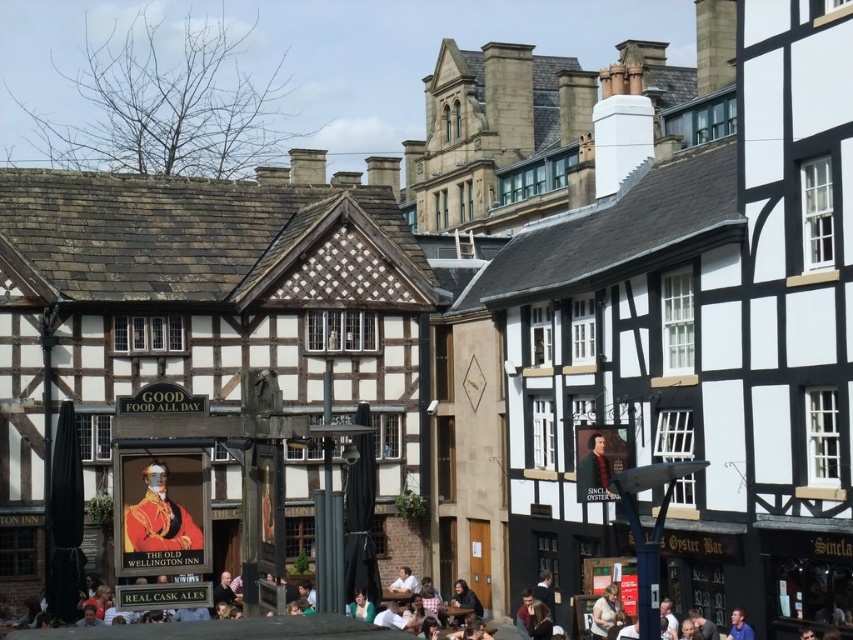
Who is higher up, white casual clothing at lower center or green fabric jacket at lower center?

Positioned higher is green fabric jacket at lower center.

Who is more distant from viewer, (173, 637) or (608, 474)?

Positioned behind is point (608, 474).

At what (x,y) coordinates should I click in order to perform the action: click on white casual clothing at lower center. Please return your answer as a coordinate pair (x, y). This screenshot has width=853, height=640. Looking at the image, I should click on (230, 628).

Looking at this image, is green fabric jacket at lower center thinner than light brown leather jacket at lower center?

No.

Between point (578, 472) and point (590, 625), which one is positioned behind?

The point (590, 625) is behind.

Does point (576, 496) come behind point (613, 625)?

Yes, point (576, 496) is farther from viewer.

Where is `green fabric jacket at lower center`? This screenshot has height=640, width=853. green fabric jacket at lower center is located at coordinates (595, 472).

Does gold textured uniform at center appear under light brown leather jacket at lower center?

Incorrect, gold textured uniform at center is not positioned below light brown leather jacket at lower center.

Does gold textured uniform at center appear on the right side of light brown leather jacket at lower center?

Incorrect, gold textured uniform at center is not on the right side of light brown leather jacket at lower center.

Identify the location of gold textured uniform at center. (160, 518).

Identify the location of gold textured uniform at center. (160, 518).